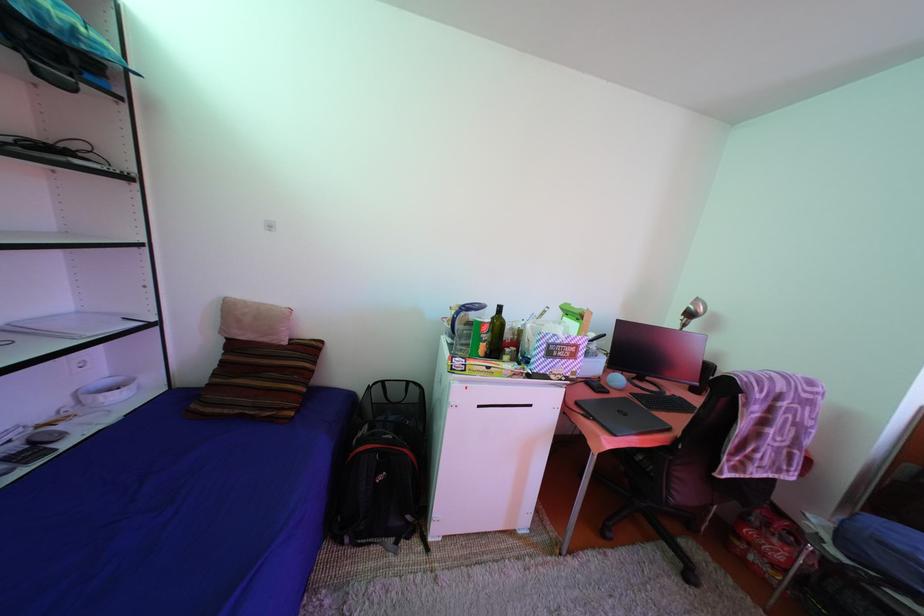
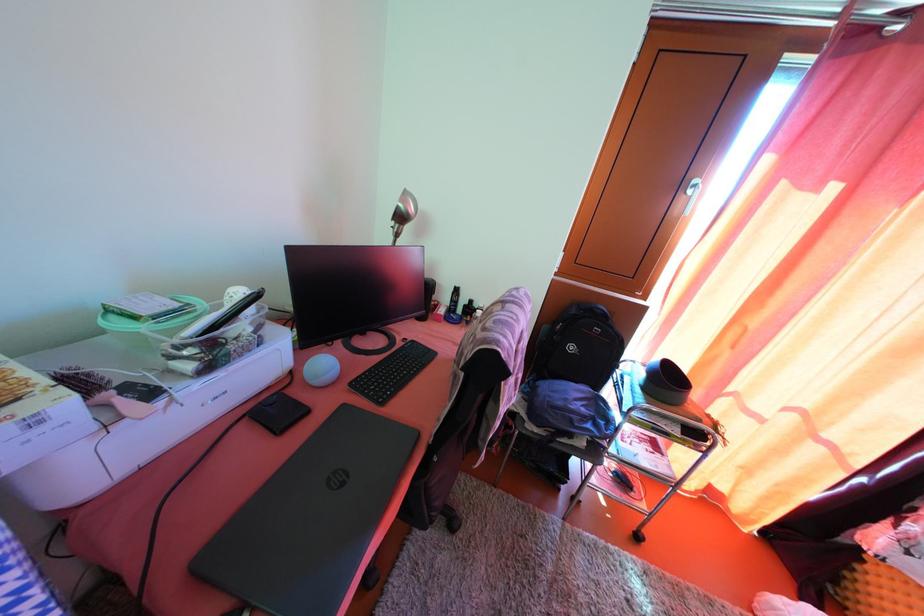
First-person continuous shooting, in which direction is the camera rotating?

The camera rotated toward right-down.